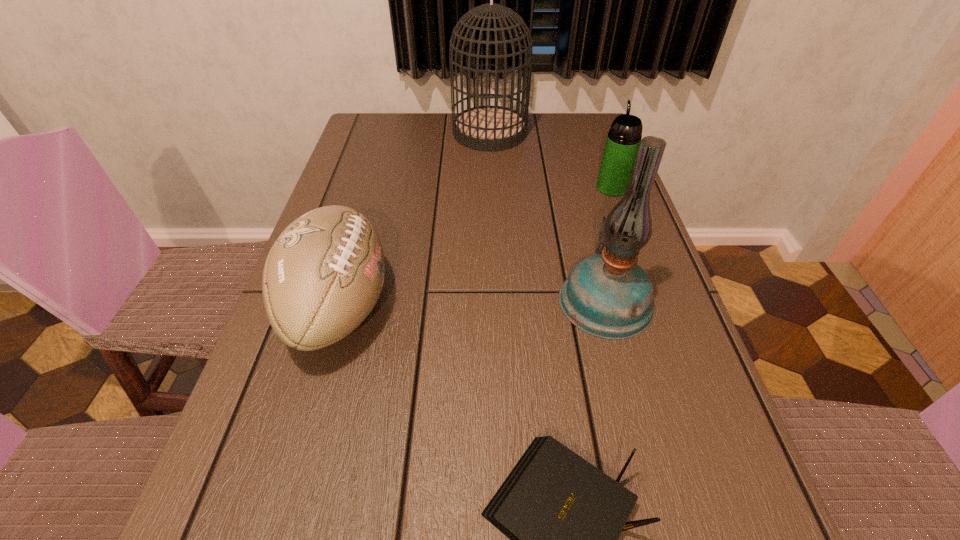
You are a GUI agent. You are given a task and a screenshot of the screen. Output one action in this format:
    pyautogui.click(x=<x>, y=<y>)
    Task: Click on the free point between the farthest object and the football (American)
    Image resolution: width=960 pixels, height=540 pixels.
    Given the screenshot: What is the action you would take?
    pyautogui.click(x=415, y=220)

I want to click on vacant area between the leftmost object and the birdcage, so click(x=415, y=220).

You are a GUI agent. You are given a task and a screenshot of the screen. Output one action in this format:
    pyautogui.click(x=<x>, y=<y>)
    Task: Click on the empty space that is in between the football (American) and the thermos bottle
    This screenshot has height=540, width=960.
    Given the screenshot: What is the action you would take?
    pyautogui.click(x=476, y=248)

Where is `vacant space that is in between the thermos bottle and the birdcage`? The image size is (960, 540). vacant space that is in between the thermos bottle and the birdcage is located at coordinates (551, 160).

This screenshot has height=540, width=960. I want to click on vacant area that lies between the thermos bottle and the tallest object, so point(551,160).

Locate an element on the screen. The image size is (960, 540). free space between the farthest object and the leftmost object is located at coordinates (415, 220).

Identify the location of vacant area that lies between the fourth nearest object and the birdcage. The width and height of the screenshot is (960, 540). (551, 160).

This screenshot has width=960, height=540. In order to click on free space between the thermos bottle and the tallest object in this screenshot , I will do `click(551, 160)`.

Locate which object ranks fourth in proximity to the fourth nearest object. Please provide its 2D coordinates. Your answer should be formatted as a tuple, i.e. [(x, y)], where the tuple contains the x and y coordinates of a point satisfying the conditions above.

[(563, 516)]

Identify which object is located as the fourth nearest to the second farthest object. Please provide its 2D coordinates. Your answer should be formatted as a tuple, i.e. [(x, y)], where the tuple contains the x and y coordinates of a point satisfying the conditions above.

[(563, 516)]